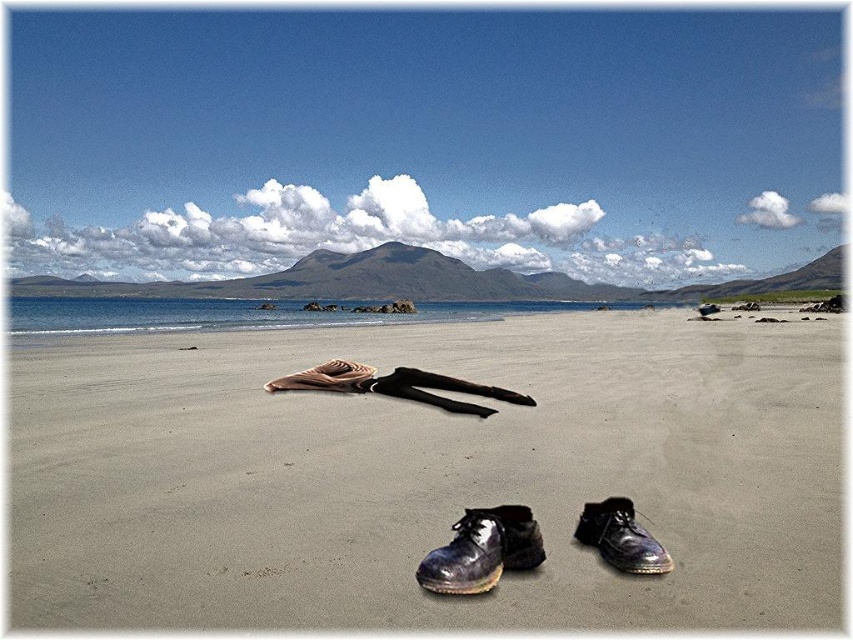
Question: Can you confirm if shiny black boot at lower center is positioned to the left of shiny leather shoe at center?

Choices:
 (A) no
 (B) yes

Answer: (B)

Question: Which of these objects is positioned farthest from the shiny black shoe at lower right?

Choices:
 (A) smooth sand at center
 (B) shiny black boot at lower center

Answer: (A)

Question: Can you confirm if shiny black boot at lower center is thinner than shiny leather shoe at center?

Choices:
 (A) no
 (B) yes

Answer: (A)

Question: Which is farther from the shiny black boot at lower center?

Choices:
 (A) shiny leather shoe at center
 (B) shiny black shoe at lower right
 (C) smooth sand at center

Answer: (C)

Question: Considering the real-world distances, which object is closest to the shiny black boot at lower center?

Choices:
 (A) shiny black shoe at lower right
 (B) smooth sand at center

Answer: (A)

Question: Is smooth sand at center thinner than shiny black shoe at lower right?

Choices:
 (A) yes
 (B) no

Answer: (B)